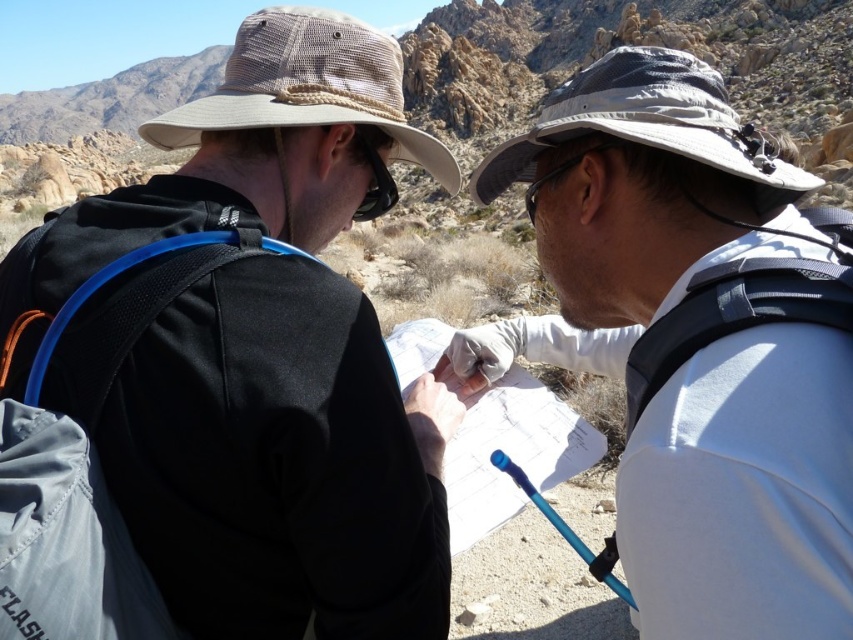
Find the location of a particular element. This screenshot has width=853, height=640. black matte jacket at upper left is located at coordinates (225, 376).

Is black matte jacket at upper left smaller than white matte paper at center?

No.

Describe the element at coordinates (225, 376) in the screenshot. I see `black matte jacket at upper left` at that location.

Where is `black matte jacket at upper left`? Image resolution: width=853 pixels, height=640 pixels. black matte jacket at upper left is located at coordinates (225, 376).

Who is lower down, black matte jacket at upper left or white paper at center?

Positioned lower is white paper at center.

Is black matte jacket at upper left behind white paper at center?

No, it is in front of white paper at center.

Locate an element on the screen. The width and height of the screenshot is (853, 640). black matte jacket at upper left is located at coordinates (225, 376).

Where is `black matte jacket at upper left`? black matte jacket at upper left is located at coordinates pyautogui.click(x=225, y=376).

Is point (804, 355) in front of point (531, 449)?

That is True.

Who is more forward, (630,545) or (403,324)?

Point (630,545)

This screenshot has height=640, width=853. I want to click on white matte paper at center, so click(631, 208).